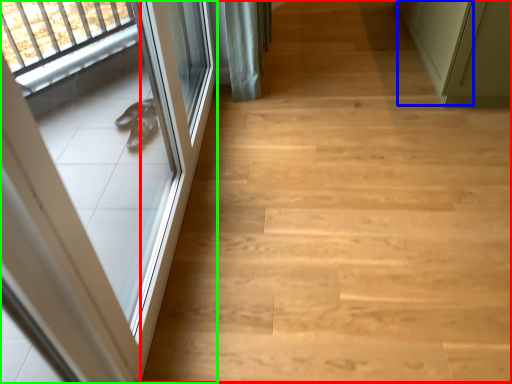
Question: Based on their relative distances, which object is nearer to stairwell (highlighted by a red box)? Choose from door (highlighted by a blue box) and door (highlighted by a green box).

Choices:
 (A) door
 (B) door

Answer: (B)